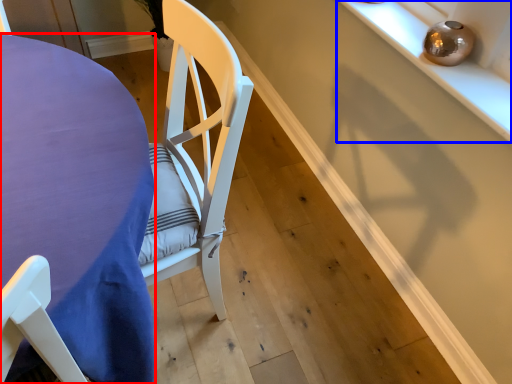
Question: Which point is closer to the camera, table (highlighted by a red box) or shelf (highlighted by a blue box)?

Choices:
 (A) table
 (B) shelf

Answer: (A)